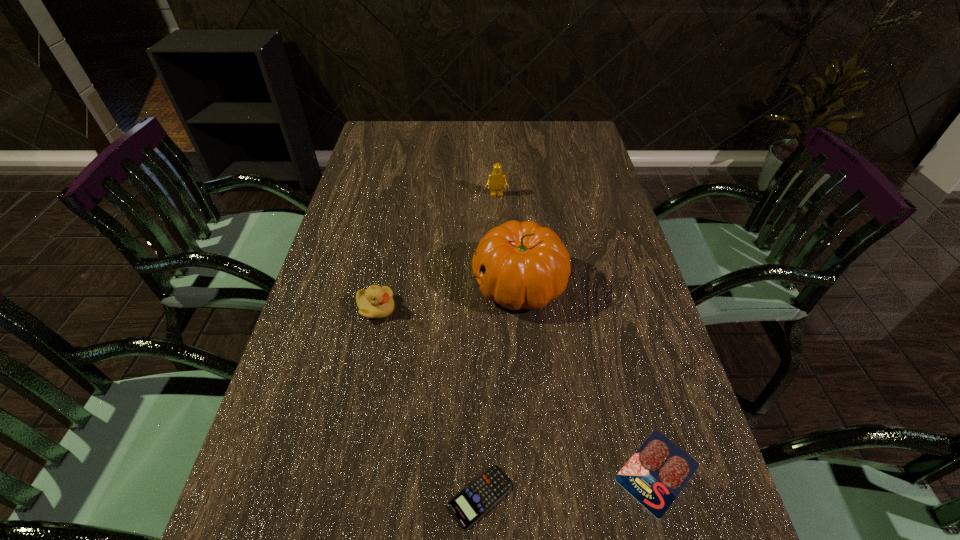
The image size is (960, 540). What are the coordinates of `the tallest object` in the screenshot? It's located at (519, 265).

At what (x,y) coordinates should I click in order to perform the action: click on Lego. Please return your answer as a coordinate pair (x, y). This screenshot has height=540, width=960. Looking at the image, I should click on (496, 179).

The width and height of the screenshot is (960, 540). I want to click on the fourth shortest object, so click(496, 179).

This screenshot has width=960, height=540. I want to click on the leftmost object, so click(x=376, y=302).

Find the location of a particular element. This screenshot has width=960, height=540. duckling is located at coordinates (376, 302).

Identify the location of calculator. The width and height of the screenshot is (960, 540). (470, 504).

You are a GUI agent. You are given a task and a screenshot of the screen. Output one action in this format:
    pyautogui.click(x=<x>, y=<y>)
    Task: Click on the rightmost object
    
    Given the screenshot: What is the action you would take?
    pyautogui.click(x=655, y=475)

Where is `vacant space positioned 0.370m on the carved face of the pumpkin`? The width and height of the screenshot is (960, 540). vacant space positioned 0.370m on the carved face of the pumpkin is located at coordinates (326, 284).

Locate an element on the screen. free space located 0.350m on the carved face of the pumpkin is located at coordinates (334, 284).

The height and width of the screenshot is (540, 960). Find the location of `free region located on the carved face of the pumpkin`. free region located on the carved face of the pumpkin is located at coordinates (413, 284).